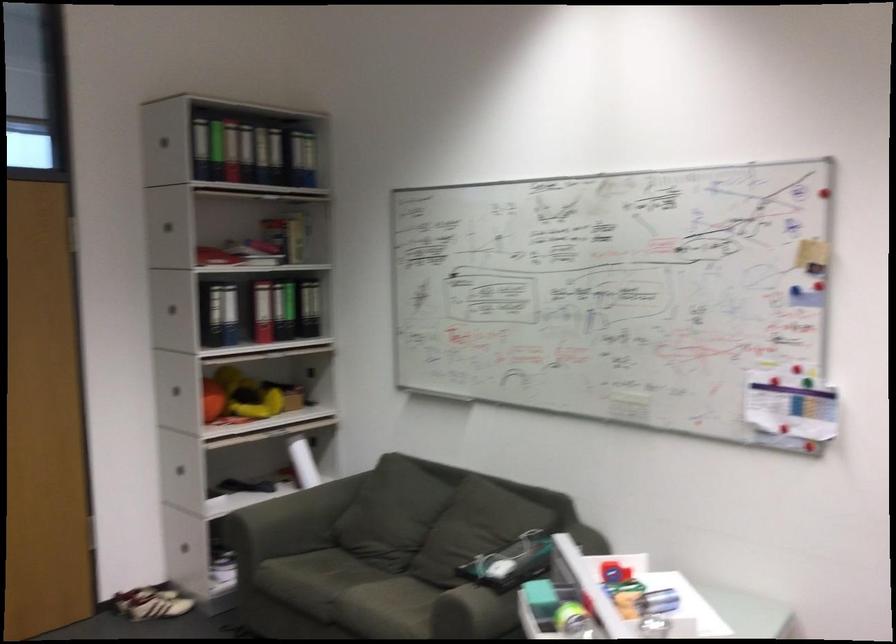
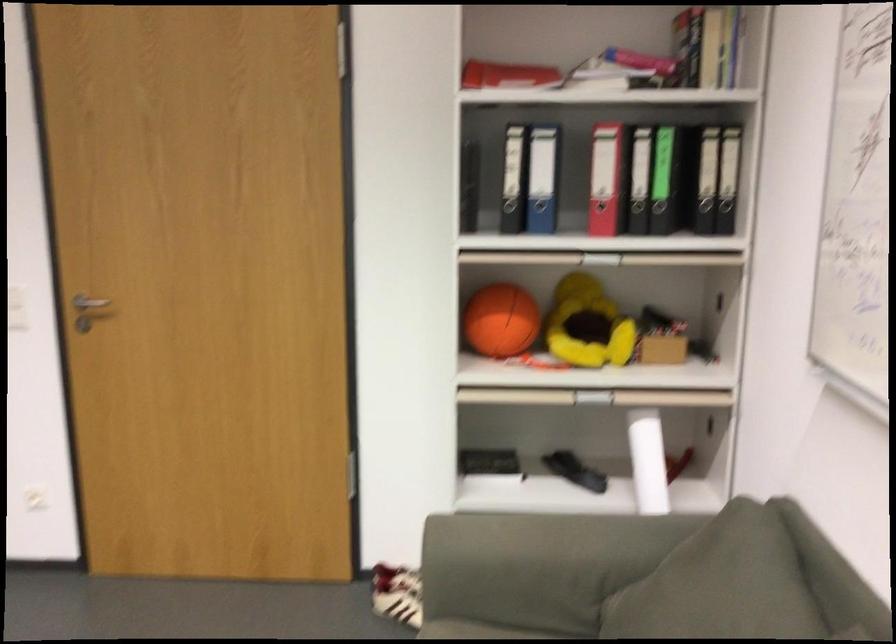
Locate, in the second image, the point that corresponds to point (304, 473) in the first image.

(648, 460)